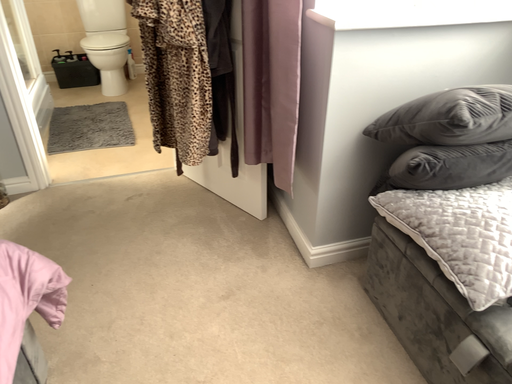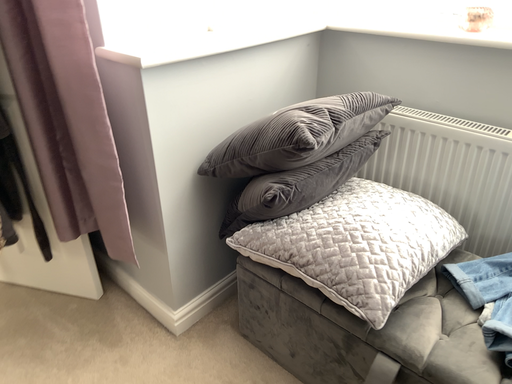
Question: How did the camera likely rotate when shooting the video?

Choices:
 (A) rotated downward
 (B) rotated upward

Answer: (B)